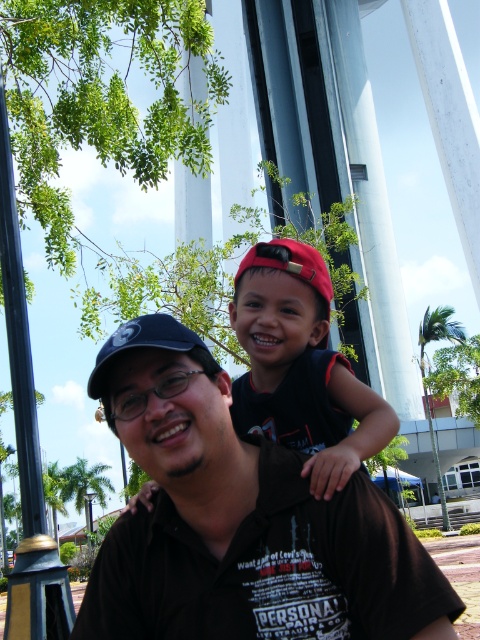
Question: Is matte red cap at upper center bigger than matte black baseball cap at center?

Choices:
 (A) yes
 (B) no

Answer: (B)

Question: Which point is closer to the camera?

Choices:
 (A) matte red cap at upper center
 (B) matte black shirt at center

Answer: (B)

Question: Considering the real-world distances, which object is farthest from the matte black shirt at center?

Choices:
 (A) brushed metal lamp post at left
 (B) matte red cap at upper center

Answer: (A)

Question: Which point appears farthest from the camera in this image?

Choices:
 (A) (162, 321)
 (B) (240, 564)
 (C) (289, 364)

Answer: (C)

Question: Does matte black baseball cap at center appear over brushed metal lamp post at left?

Choices:
 (A) yes
 (B) no

Answer: (A)

Question: Does matte red cap at upper center appear on the left side of brushed metal lamp post at left?

Choices:
 (A) no
 (B) yes

Answer: (A)